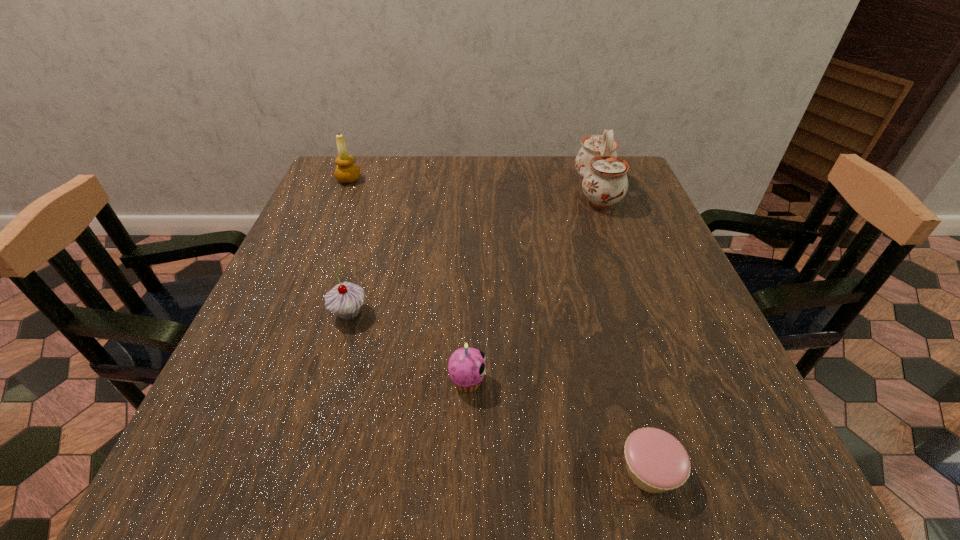
Identify the location of chinaware positioned at the right edge. The height and width of the screenshot is (540, 960). (605, 182).

Image resolution: width=960 pixels, height=540 pixels. In order to click on cupcake positioned at the right edge in this screenshot , I will do `click(656, 461)`.

Where is `object at the far left corner`? Image resolution: width=960 pixels, height=540 pixels. object at the far left corner is located at coordinates (346, 172).

Where is `object at the far right corner`? This screenshot has height=540, width=960. object at the far right corner is located at coordinates (605, 182).

Identify the location of object that is positioned at the near right corner. Image resolution: width=960 pixels, height=540 pixels. (656, 461).

Locate an element on the screen. The image size is (960, 540). free space at the far edge is located at coordinates (454, 159).

Identify the location of free location at the near edge of the desktop. The width and height of the screenshot is (960, 540). (466, 487).

Find the location of a particular element. vacant space at the left edge of the desktop is located at coordinates (317, 213).

Where is `free space at the right edge of the desktop`? free space at the right edge of the desktop is located at coordinates (655, 268).

Locate an element on the screen. This screenshot has height=540, width=960. free point at the far right corner is located at coordinates (631, 187).